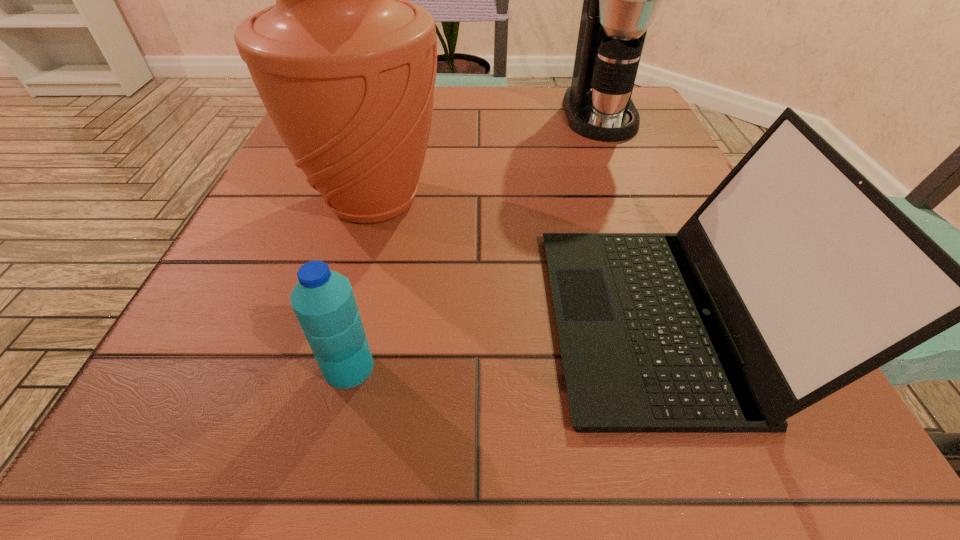
This screenshot has height=540, width=960. Find the location of `vacant space at the far right corner of the desktop`. vacant space at the far right corner of the desktop is located at coordinates (635, 89).

Where is `vacant area that lies between the farthest object and the third tallest object`? The height and width of the screenshot is (540, 960). vacant area that lies between the farthest object and the third tallest object is located at coordinates (631, 216).

Where is `free space between the coffee maker and the shortest object`? Image resolution: width=960 pixels, height=540 pixels. free space between the coffee maker and the shortest object is located at coordinates (474, 241).

Locate an element on the screen. empty space that is in between the farthest object and the laptop is located at coordinates (631, 216).

This screenshot has width=960, height=540. In order to click on blank region between the farthest object and the vase in this screenshot , I will do `click(487, 157)`.

This screenshot has width=960, height=540. I want to click on unoccupied area between the vase and the second shortest object, so click(517, 259).

Where is `blank region between the vase and the water bottle`? blank region between the vase and the water bottle is located at coordinates (361, 284).

The height and width of the screenshot is (540, 960). What are the coordinates of `empty space that is in between the vase and the farthest object` in the screenshot? It's located at (487, 157).

At what (x,y) coordinates should I click in order to perform the action: click on vacant space that is in between the shortest object and the farthest object. Please return your answer as a coordinate pair (x, y). Image resolution: width=960 pixels, height=540 pixels. Looking at the image, I should click on (474, 241).

The height and width of the screenshot is (540, 960). Identify the location of unoccupied area between the laptop and the shortest object. (505, 342).